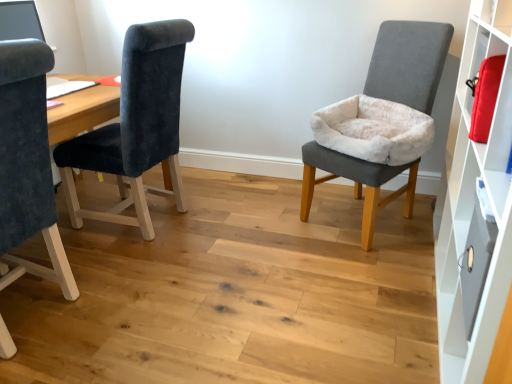
Question: Is point (52, 210) closer or farther from the camera than point (170, 150)?

Choices:
 (A) farther
 (B) closer

Answer: (B)

Question: From a real-world perspective, is velvet dark blue chair at left, the third chair viewed from the right, above or below velvet dark blue chair at left, the second chair positioned from the left?

Choices:
 (A) above
 (B) below

Answer: (B)

Question: Which object is positioned farthest from the velvet dark blue chair at left, positioned as the second chair in right-to-left order?

Choices:
 (A) white matte cabinet at right
 (B) metallic gray drawer at right
 (C) velvet dark blue chair at left, which is the 1th chair from left to right
 (D) velvet gray chair at right, acting as the third chair starting from the left

Answer: (B)

Question: Which of these objects is positioned farthest from the velvet gray chair at right, acting as the third chair starting from the left?

Choices:
 (A) metallic gray drawer at right
 (B) velvet dark blue chair at left, the third chair viewed from the right
 (C) velvet dark blue chair at left, the second chair positioned from the left
 (D) white matte cabinet at right

Answer: (B)